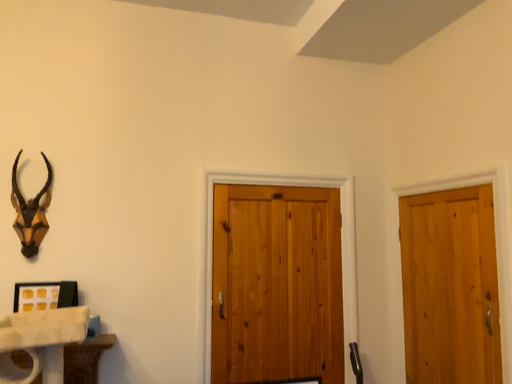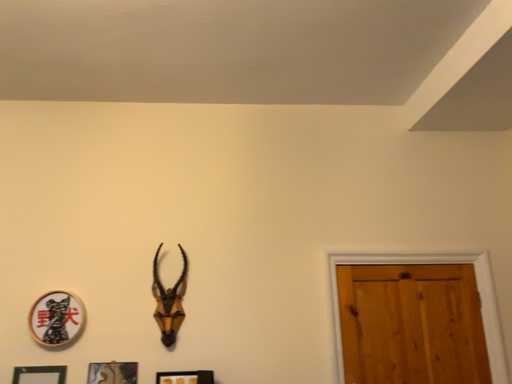
Question: Which way did the camera rotate in the video?

Choices:
 (A) rotated downward
 (B) rotated upward

Answer: (B)